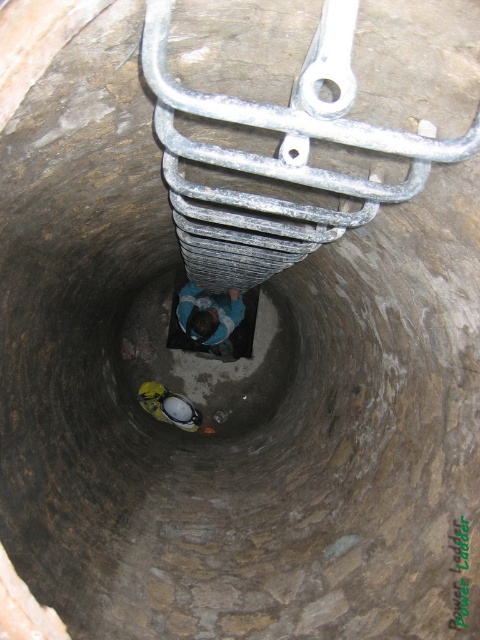
Question: Which of the following is the closest to the observer?

Choices:
 (A) blue fabric shirt at center
 (B) smooth concrete hole at center
 (C) galvanized metal ladder at center
 (D) yellow fabric helmet at center

Answer: (C)

Question: Is galvanized metal ladder at center thinner than smooth concrete hole at center?

Choices:
 (A) yes
 (B) no

Answer: (A)

Question: Does galvanized metal ladder at center have a lesser width compared to yellow fabric helmet at center?

Choices:
 (A) no
 (B) yes

Answer: (A)

Question: Which of the following is the closest to the observer?

Choices:
 (A) galvanized metal ladder at center
 (B) smooth concrete hole at center
 (C) blue fabric shirt at center
 (D) yellow fabric helmet at center

Answer: (A)

Question: Among these points, which one is farthest from the camera?

Choices:
 (A) (133, 412)
 (B) (152, 403)
 (C) (373, 204)
 (D) (231, 301)

Answer: (B)

Question: Is blue fabric shirt at center positioned in front of yellow fabric helmet at center?

Choices:
 (A) no
 (B) yes

Answer: (B)